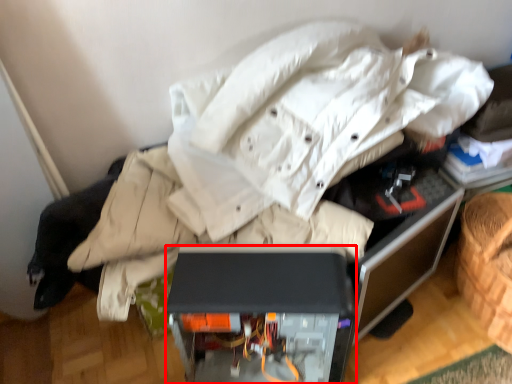
Question: Observing the image, what is the correct spatial positioning of furniture (annotated by the red box) in reference to computer desk?

Choices:
 (A) left
 (B) right

Answer: (B)